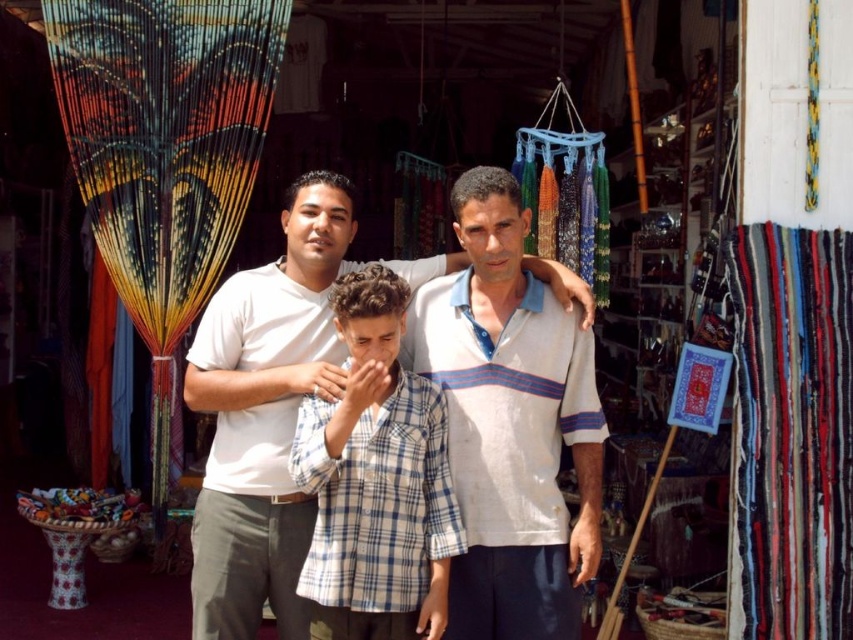
Who is higher up, white striped polo shirt at center or blue plaid shirt at center?

white striped polo shirt at center

Is point (579, 380) farther from camera compared to point (395, 481)?

Yes, point (579, 380) is farther from viewer.

The height and width of the screenshot is (640, 853). What are the coordinates of `white striped polo shirt at center` in the screenshot? It's located at (509, 422).

At what (x,y) coordinates should I click in order to perform the action: click on white striped polo shirt at center. Please return your answer as a coordinate pair (x, y). Looking at the image, I should click on (509, 422).

Can you confirm if white striped polo shirt at center is positioned to the right of white striped shirt at center?

Yes, white striped polo shirt at center is to the right of white striped shirt at center.

Based on the photo, is white striped polo shirt at center bigger than white striped shirt at center?

Incorrect, white striped polo shirt at center is not larger than white striped shirt at center.

Does point (575, 451) come behind point (212, 566)?

Yes, point (575, 451) is behind point (212, 566).

I want to click on white striped polo shirt at center, so click(x=509, y=422).

At what (x,y) coordinates should I click in order to perform the action: click on white striped shirt at center. Please return your answer as a coordinate pair (x, y). The image size is (853, 640). Looking at the image, I should click on (265, 413).

Locate an element on the screen. This screenshot has height=640, width=853. white striped shirt at center is located at coordinates (265, 413).